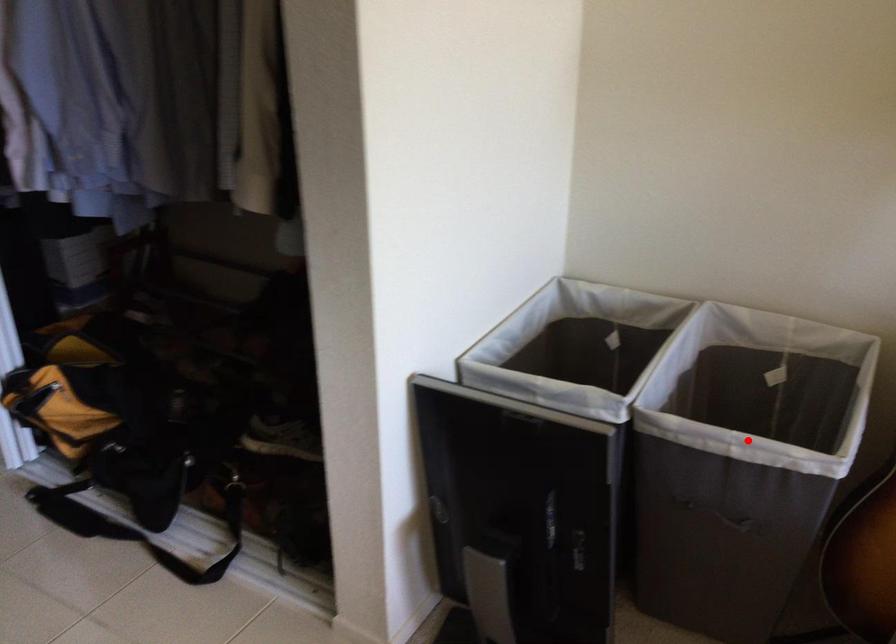
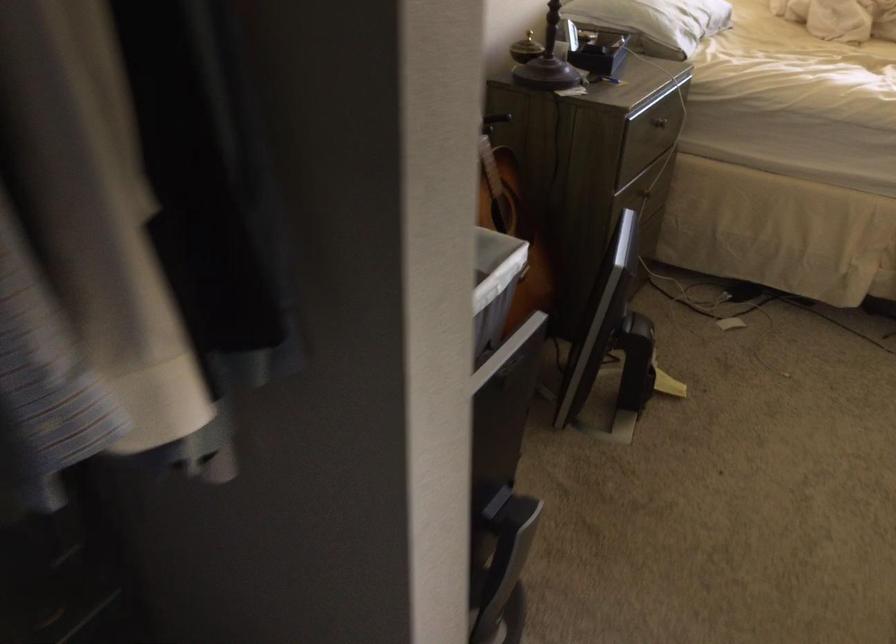
Question: I am providing you with two images of the same scene from different viewpoints. In image1, a red point is highlighted. Considering the same 3D point in image2, which of the following is correct?

Choices:
 (A) It is closer
 (B) It is farther

Answer: (B)